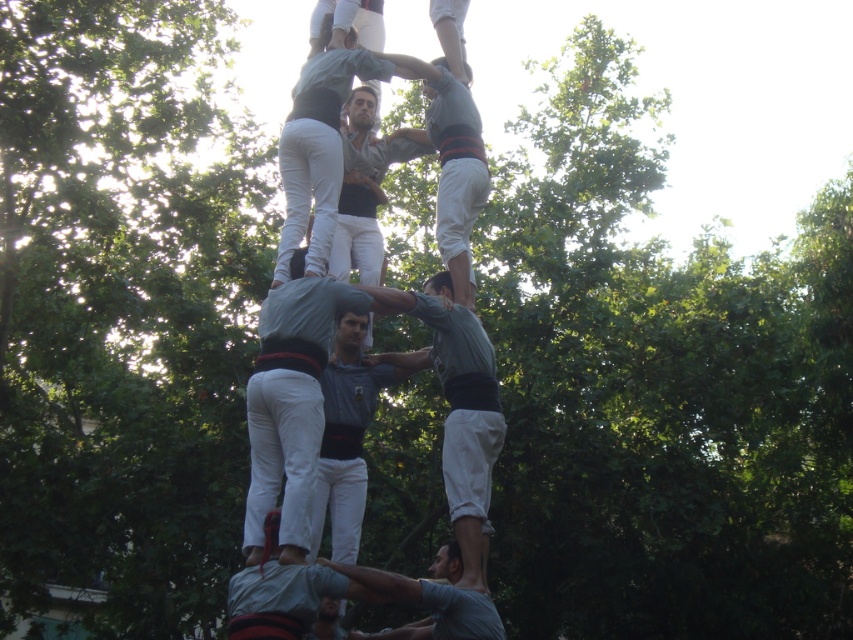
Does matte gray shirt at center have a greater height compared to gray cotton shirt at lower center?

Yes.

In the scene shown: Who is more forward, [450,394] or [334,566]?

Positioned in front is point [334,566].

Locate an element on the screen. This screenshot has width=853, height=640. matte gray shirt at center is located at coordinates (460, 412).